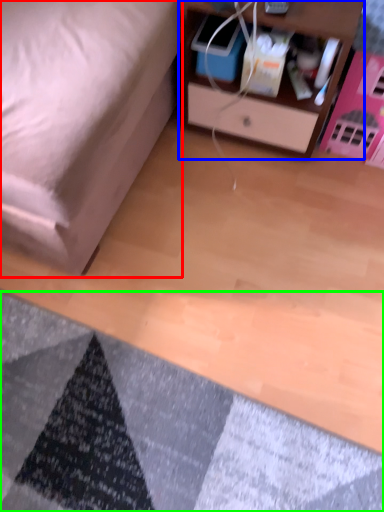
Question: Estimate the real-world distances between objects in this image. Which object is closer to furniture (highlighted by a red box), nightstand (highlighted by a blue box) or mat (highlighted by a green box)?

Choices:
 (A) nightstand
 (B) mat

Answer: (A)